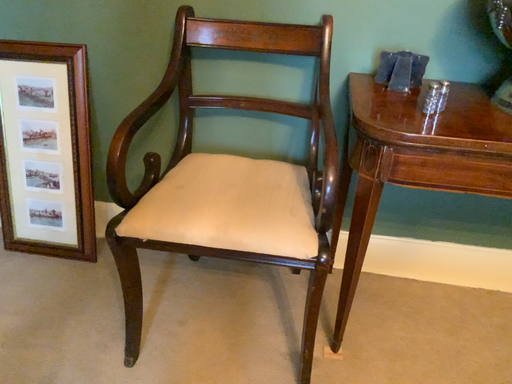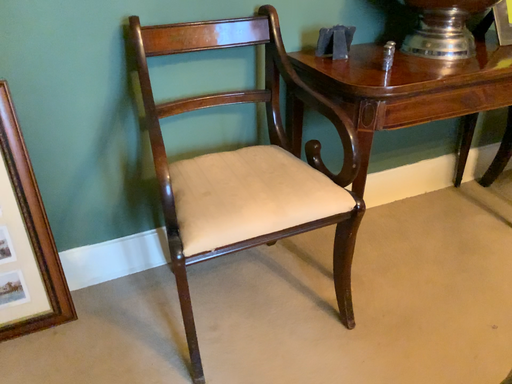
Question: Which way did the camera rotate in the video?

Choices:
 (A) rotated left
 (B) rotated right

Answer: (B)